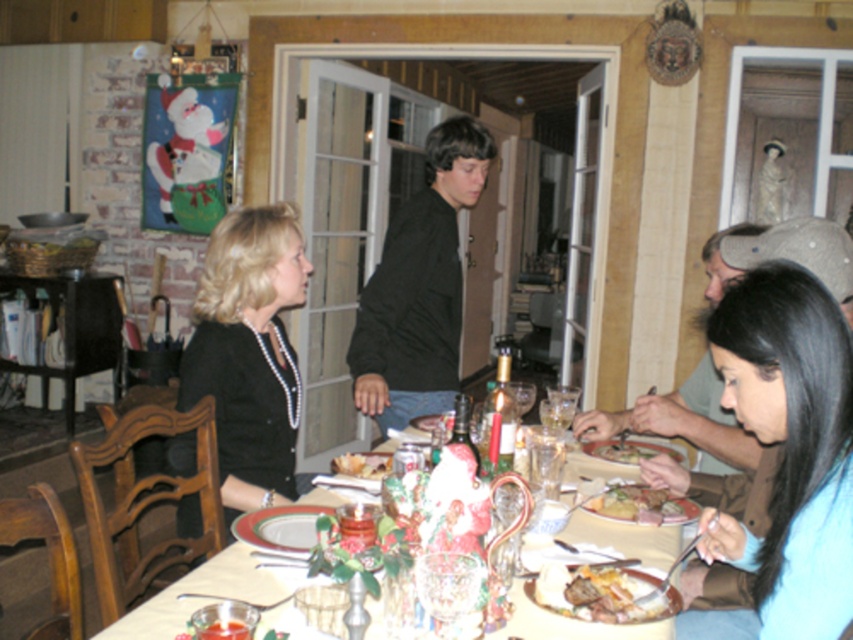
Question: Can you confirm if porcelain plate at center is thinner than golden brown bread at lower right?

Choices:
 (A) yes
 (B) no

Answer: (A)

Question: Which point is farther to the camera?

Choices:
 (A) (360, 456)
 (B) (657, 579)
 (C) (606, 451)

Answer: (C)

Question: Is black pearl necklace at upper left bigger than golden brown bread at center?

Choices:
 (A) yes
 (B) no

Answer: (A)

Question: Among these points, which one is farthest from the camera?

Choices:
 (A) (357, 348)
 (B) (599, 586)
 (C) (339, 461)

Answer: (A)

Question: Does black silk shirt at lower right appear on the right side of golden brown bread at lower right?

Choices:
 (A) no
 (B) yes

Answer: (B)

Question: Which point is farther to the camera?

Choices:
 (A) black pearl necklace at upper left
 (B) green leafy salad at lower center
 (C) porcelain plate at center

Answer: (A)